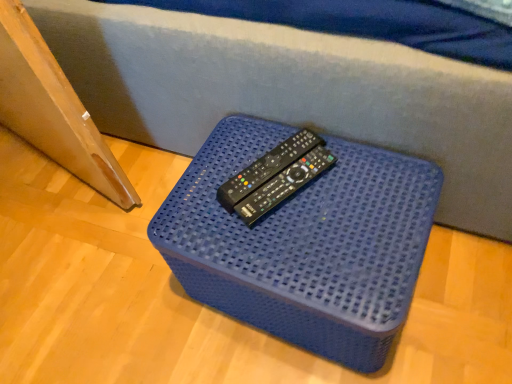
Find the location of a particular element. The height and width of the screenshot is (384, 512). vacant area that is in front of black plastic remote at center is located at coordinates pos(305,247).